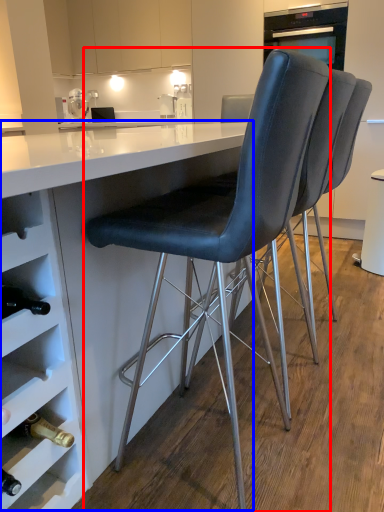
Question: Which point is further to the camera, chair (highlighted by a red box) or table (highlighted by a blue box)?

Choices:
 (A) chair
 (B) table

Answer: (A)